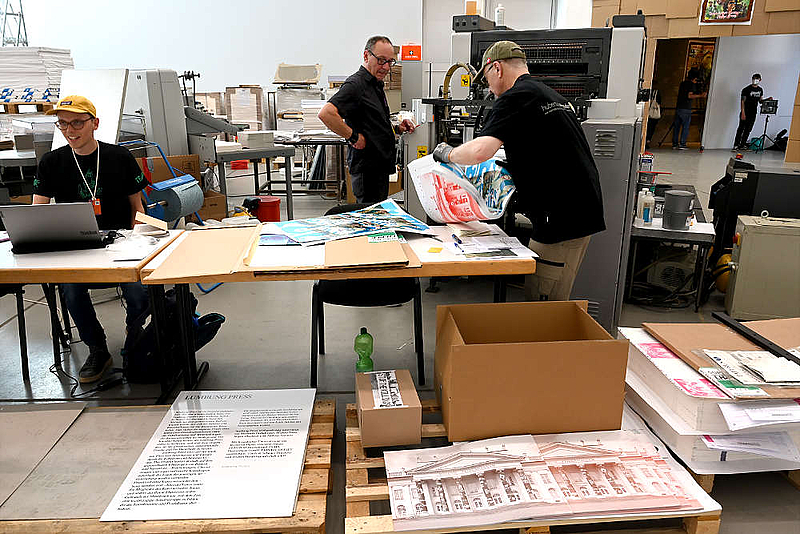
The image size is (800, 534). In order to click on table in this screenshot , I will do pyautogui.click(x=261, y=157), pyautogui.click(x=308, y=142), pyautogui.click(x=380, y=277), pyautogui.click(x=49, y=273).